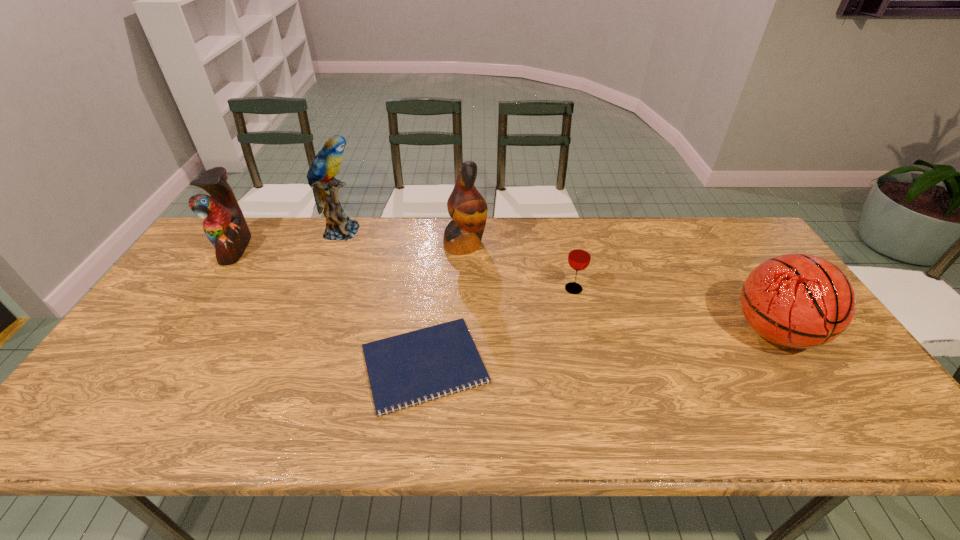
The image size is (960, 540). Identify the location of free space between the notepad and the basketball. (599, 348).

You are a GUI agent. You are given a task and a screenshot of the screen. Output one action in this format:
    pyautogui.click(x=<x>, y=<y>)
    Task: Click on the vacant area between the rightmost object and the second parrot from right to left
    This screenshot has width=960, height=540.
    Given the screenshot: What is the action you would take?
    pyautogui.click(x=558, y=281)

Identify the location of free spot between the rightmost parrot and the shortest object. The image size is (960, 540). (444, 304).

The height and width of the screenshot is (540, 960). In order to click on the fifth closest object relative to the second object from right to left in this screenshot , I will do pyautogui.click(x=224, y=225).

Point out which object is positioned as the second nearest to the second shortest object. Please provide its 2D coordinates. Your answer should be formatted as a tuple, i.e. [(x, y)], where the tuple contains the x and y coordinates of a point satisfying the conditions above.

[(466, 206)]

At what (x,y) coordinates should I click in order to perform the action: click on parrot that is the nearest to the leftmost object. Please return your answer as a coordinate pair (x, y). This screenshot has width=960, height=540. Looking at the image, I should click on (321, 175).

Find the location of a particular element. This screenshot has height=540, width=960. parrot that stands as the closest to the fifth tallest object is located at coordinates 466,206.

You are a GUI agent. You are given a task and a screenshot of the screen. Output one action in this format:
    pyautogui.click(x=<x>, y=<y>)
    Task: Click on the free space in the image that satisfies the following two spatial constraints: 1. on the face of the rightmost parrot; 2. on the left side of the fifth object from left to right
    The image size is (960, 540).
    Given the screenshot: What is the action you would take?
    pyautogui.click(x=464, y=289)

At what (x,y) coordinates should I click in order to perform the action: click on vacant space that satisfies the following two spatial constraints: 1. on the back side of the third nearest object; 2. on the face of the rightmost parrot. Please return your answer as a coordinate pair (x, y). This screenshot has width=960, height=540. Looking at the image, I should click on (564, 244).

At what (x,y) coordinates should I click in order to perform the action: click on vacant space that satisfies the following two spatial constraints: 1. on the back side of the fifth tallest object; 2. on the right side of the notepad. Please return your answer as a coordinate pair (x, y). This screenshot has height=540, width=960. Looking at the image, I should click on (433, 289).